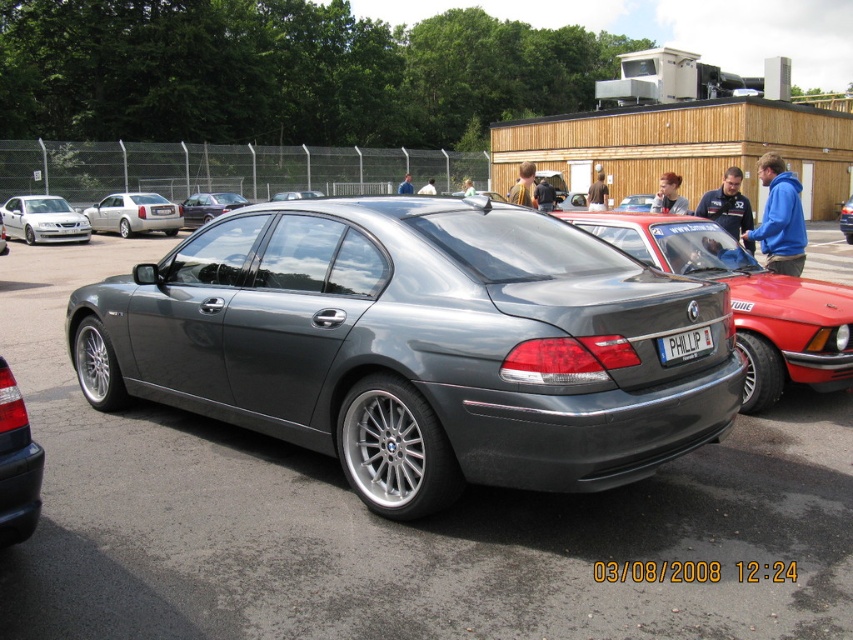
Is silver metallic sedan at left above satin silver sedan at center?

Incorrect, silver metallic sedan at left is not positioned above satin silver sedan at center.

At what (x,y) coordinates should I click in order to perform the action: click on silver metallic sedan at left. Please return your answer as a coordinate pair (x, y). Looking at the image, I should click on (134, 214).

What are the coordinates of `silver metallic sedan at left` in the screenshot? It's located at (134, 214).

Which of these two, satin metallic sedan at center or silver metallic sedan at left, stands shorter?

silver metallic sedan at left

Where is `satin metallic sedan at center`? The image size is (853, 640). satin metallic sedan at center is located at coordinates (746, 300).

Does point (572, 218) lie in front of point (107, 221)?

Yes, it is.

You are a GUI agent. You are given a task and a screenshot of the screen. Output one action in this format:
    pyautogui.click(x=<x>, y=<y>)
    Task: Click on the satin metallic sedan at center
    The image size is (853, 640).
    Given the screenshot: What is the action you would take?
    pyautogui.click(x=746, y=300)

Between satin metallic sedan at center and white plastic license plate at center, which one has less height?

white plastic license plate at center is shorter.

Between satin metallic sedan at center and white plastic license plate at center, which one appears on the right side from the viewer's perspective?

From the viewer's perspective, satin metallic sedan at center appears more on the right side.

Who is more distant from viewer, (x=668, y=221) or (x=705, y=337)?

Positioned behind is point (x=668, y=221).

Where is `satin metallic sedan at center`? satin metallic sedan at center is located at coordinates (746, 300).